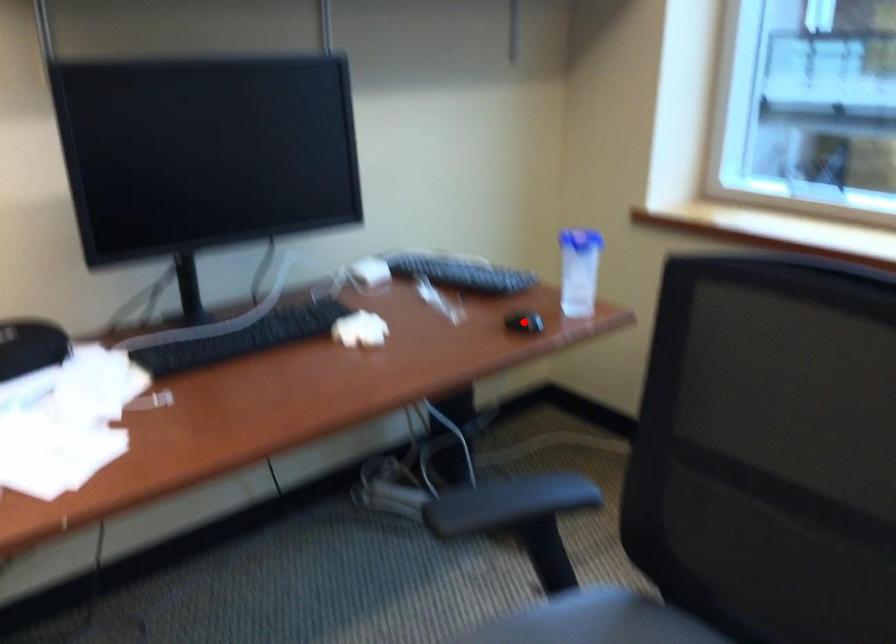
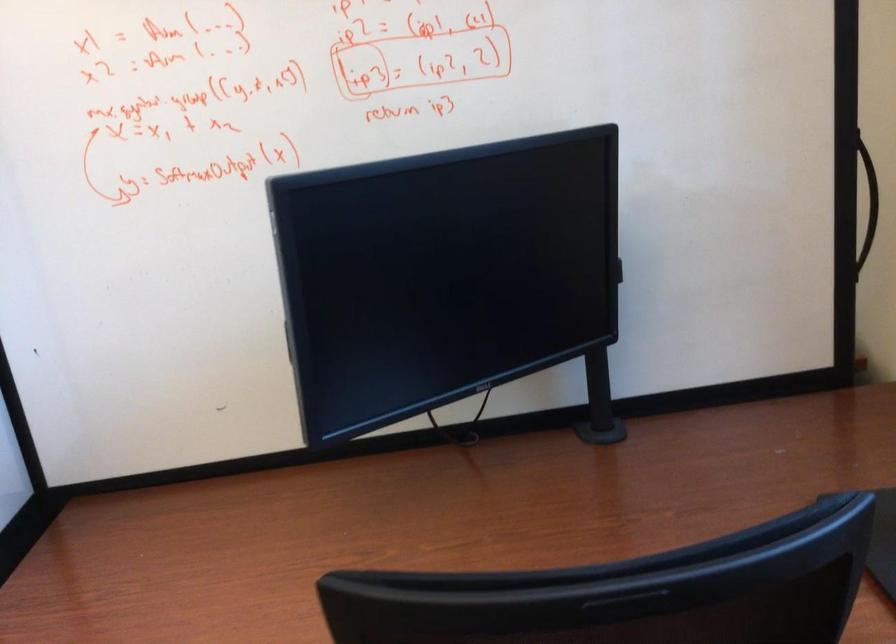
Question: I am providing you with two images of the same scene from different viewpoints. A red point is marked on the first image. Can you still see the location of the red point in image 2?

Choices:
 (A) Yes
 (B) No

Answer: (B)